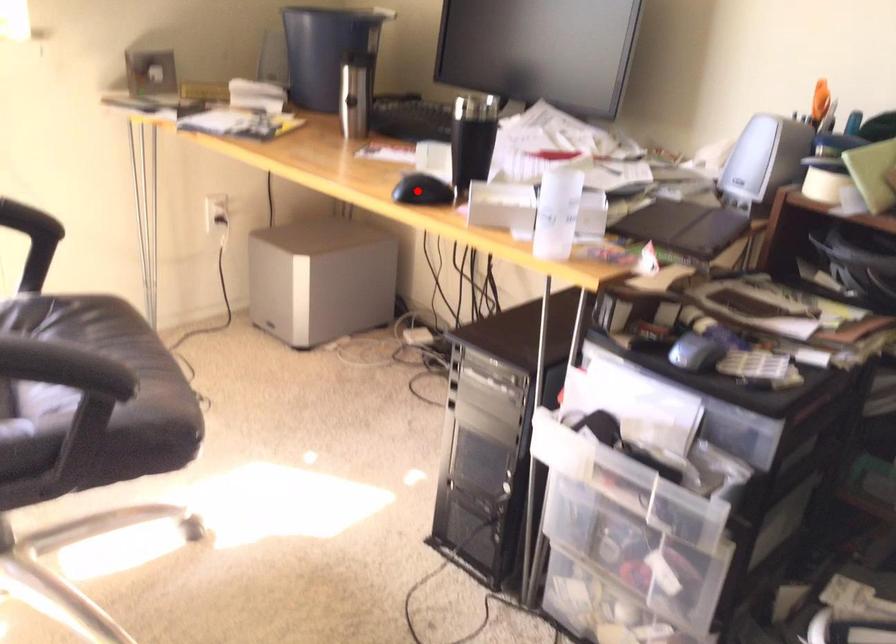
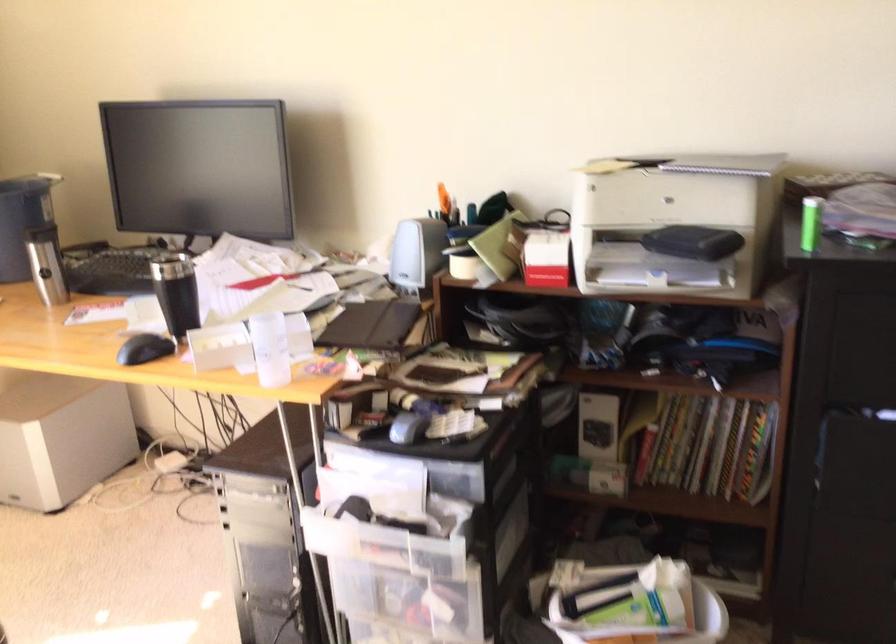
Question: I am providing you with two images of the same scene from different viewpoints. A red point is marked on the first image. Is the red point's position out of view in image 2?

Choices:
 (A) Yes
 (B) No

Answer: (B)